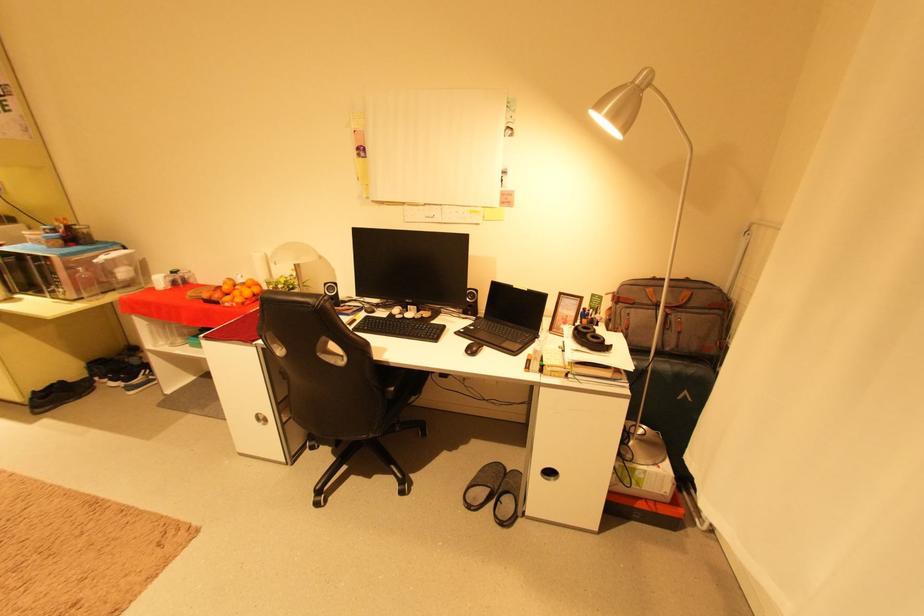
Where is `white drawer handle`? The image size is (924, 616). white drawer handle is located at coordinates (261, 419).